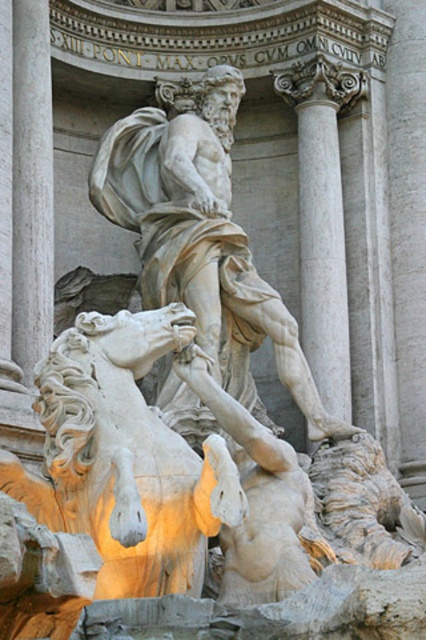
Question: Considering the relative positions of white marble statue at center and white marble column at upper center in the image provided, where is white marble statue at center located with respect to white marble column at upper center?

Choices:
 (A) above
 (B) below

Answer: (B)

Question: Which object is positioned closest to the white marble statue at center?

Choices:
 (A) white marble lion at lower center
 (B) white marble column at upper center

Answer: (B)

Question: Among these objects, which one is nearest to the camera?

Choices:
 (A) white marble statue at center
 (B) white marble lion at lower center
 (C) white marble column at upper center

Answer: (B)

Question: Is white marble lion at lower center thinner than white marble statue at center?

Choices:
 (A) no
 (B) yes

Answer: (B)

Question: Can you confirm if white marble lion at lower center is bigger than white marble statue at center?

Choices:
 (A) no
 (B) yes

Answer: (A)

Question: Which object appears closest to the camera in this image?

Choices:
 (A) white marble column at upper center
 (B) white marble statue at center
 (C) white marble lion at lower center

Answer: (C)